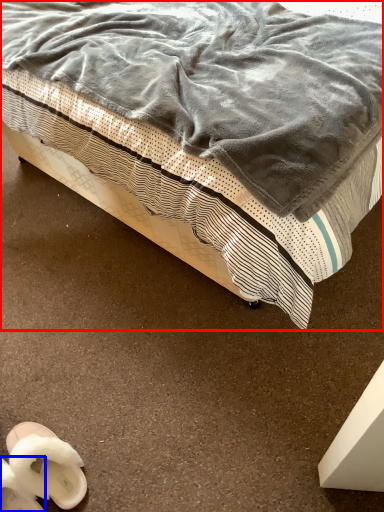
Question: Which point is closer to the camera, bed (highlighted by a red box) or footwear (highlighted by a blue box)?

Choices:
 (A) bed
 (B) footwear

Answer: (A)